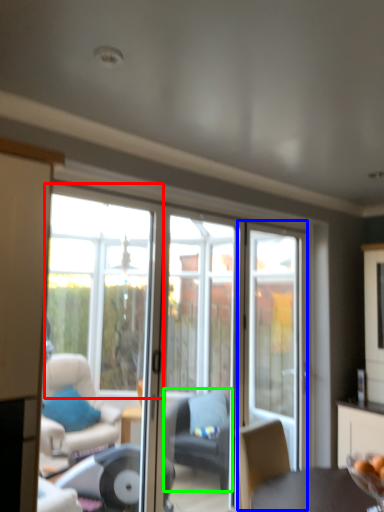
Question: Based on their relative distances, which object is farther from window (highlighted by a red box)? Choose from screen door (highlighted by a blue box) and chair (highlighted by a green box).

Choices:
 (A) screen door
 (B) chair

Answer: (A)